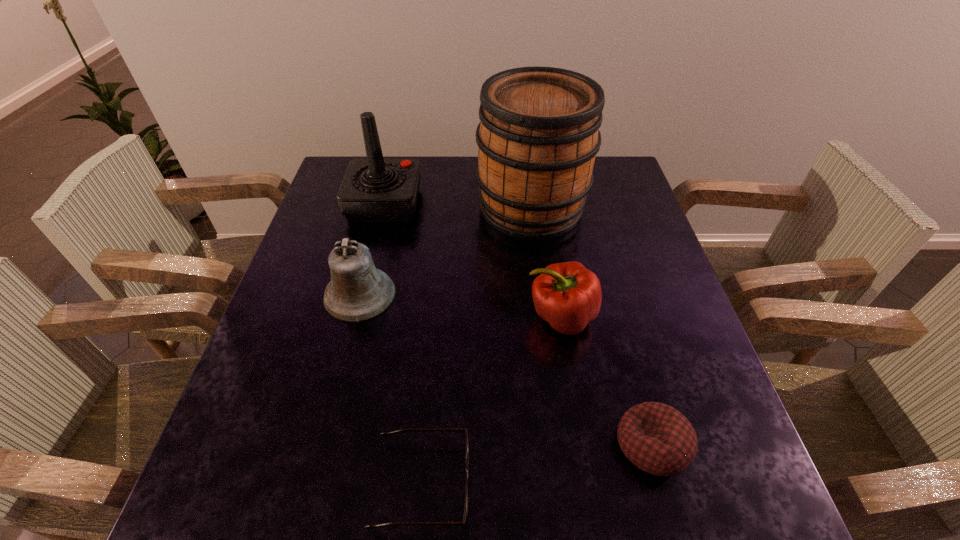
At what (x,y) coordinates should I click in order to perform the action: click on vacant space that is in between the beanbag and the cider. Please return your answer as a coordinate pair (x, y). This screenshot has height=540, width=960. Looking at the image, I should click on click(591, 326).

Find the location of a particular element. vacant space that is in between the cider and the joystick is located at coordinates (458, 206).

Find the location of a particular element. free spot between the bell pepper and the fifth shortest object is located at coordinates (472, 260).

This screenshot has width=960, height=540. What are the coordinates of `free point between the sunglasses and the tallest object` in the screenshot? It's located at (476, 346).

In order to click on vacant area between the fifth shortest object and the beanbag in this screenshot , I will do `click(518, 324)`.

I want to click on free area in between the tallest object and the beanbag, so tap(591, 326).

Locate an element on the screen. The height and width of the screenshot is (540, 960). vacant region between the fifth tallest object and the fourth object from right to left is located at coordinates (537, 464).

Locate an element on the screen. free space between the second tallest object and the tallest object is located at coordinates (458, 206).

Locate an element on the screen. This screenshot has height=540, width=960. free spot between the third object from left to right and the joystick is located at coordinates (403, 343).

Identify which object is located as the third nearest to the bell pepper. Please provide its 2D coordinates. Your answer should be formatted as a tuple, i.e. [(x, y)], where the tuple contains the x and y coordinates of a point satisfying the conditions above.

[(384, 434)]